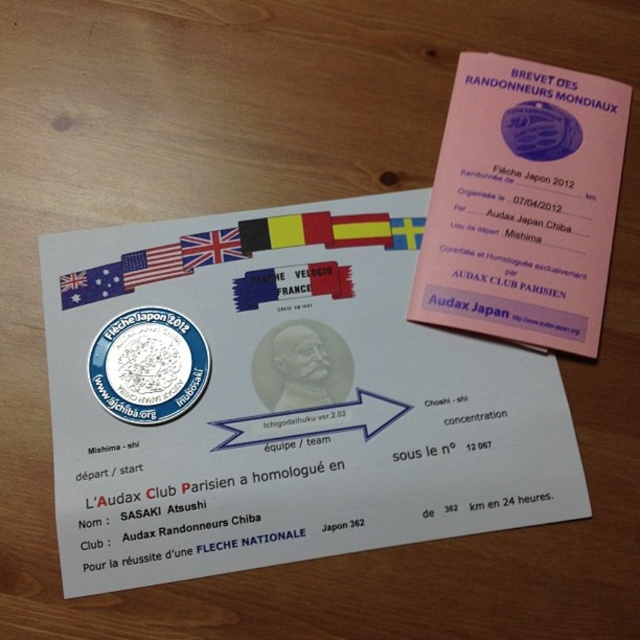
You are examining the certificates and notice two items on the certificate on the left. There is a silver metallic coin at center and a white fabric flag at upper left. Which item is located to the right of the other?

The silver metallic coin at center is positioned on the right side of white fabric flag at upper left.

You are organizing a display for the Flche Japon 2012 certificates. You have a pink paper at upper right and a silver metallic coin at center. Which object should you place first if you want to start with the larger item?

The pink paper at upper right should be placed first because it has a larger size compared to the silver metallic coin at center.